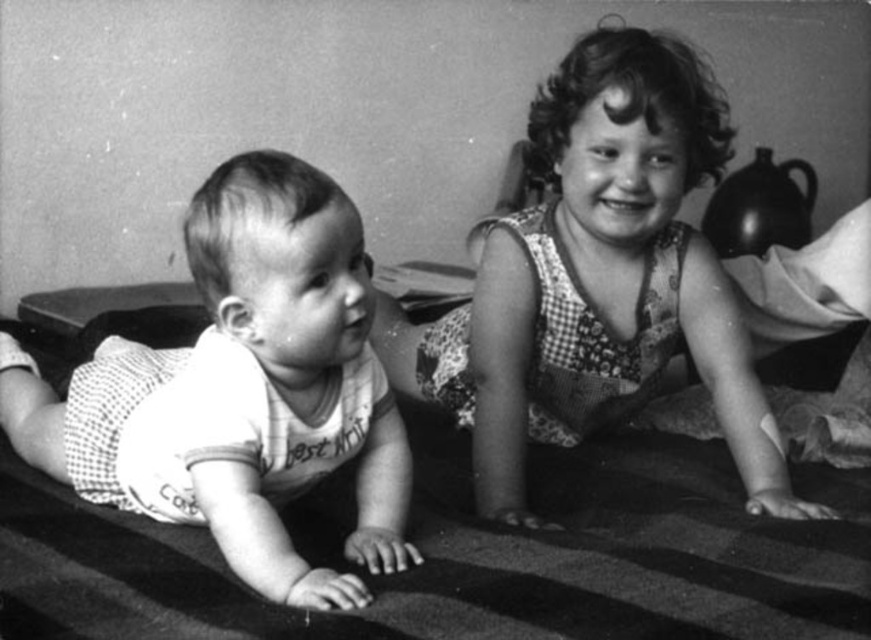
Is point (457, 321) closer to camera compared to point (350, 580)?

No, it is not.

This screenshot has height=640, width=871. Identify the location of checkered fabric dress at upper right. (598, 280).